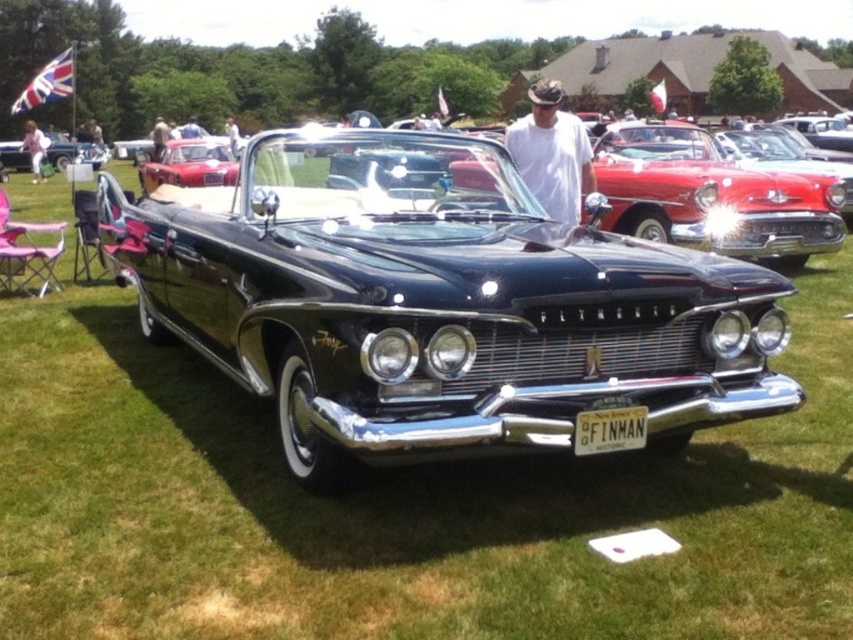
Question: Can you confirm if shiny red car at upper left is positioned to the left of pink fabric at left?

Choices:
 (A) no
 (B) yes

Answer: (A)

Question: Based on their relative distances, which object is nearer to the shiny red car at upper left?

Choices:
 (A) shiny chrome car at center
 (B) shiny black car at center
 (C) shiny black convertible at center

Answer: (B)

Question: Based on their relative distances, which object is farther from the black metal license plate at center?

Choices:
 (A) shiny black convertible at center
 (B) shiny chrome car at center

Answer: (B)

Question: Can you confirm if white cotton shirt at center is positioned below black metal license plate at center?

Choices:
 (A) yes
 (B) no

Answer: (B)

Question: Is white cotton shirt at center positioned at the back of shiny red car at upper left?

Choices:
 (A) no
 (B) yes

Answer: (A)

Question: Among these points, which one is farthest from the camera?

Choices:
 (A) (82, 145)
 (B) (215, 150)
 (C) (33, 124)

Answer: (A)